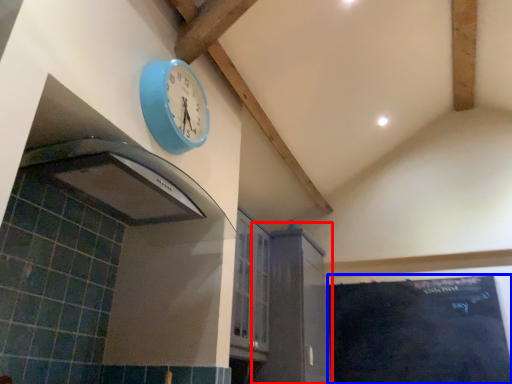
Question: Among these objects, which one is nearest to the camera, cabinetry (highlighted by a red box) or bulletin board (highlighted by a blue box)?

Choices:
 (A) cabinetry
 (B) bulletin board

Answer: (A)